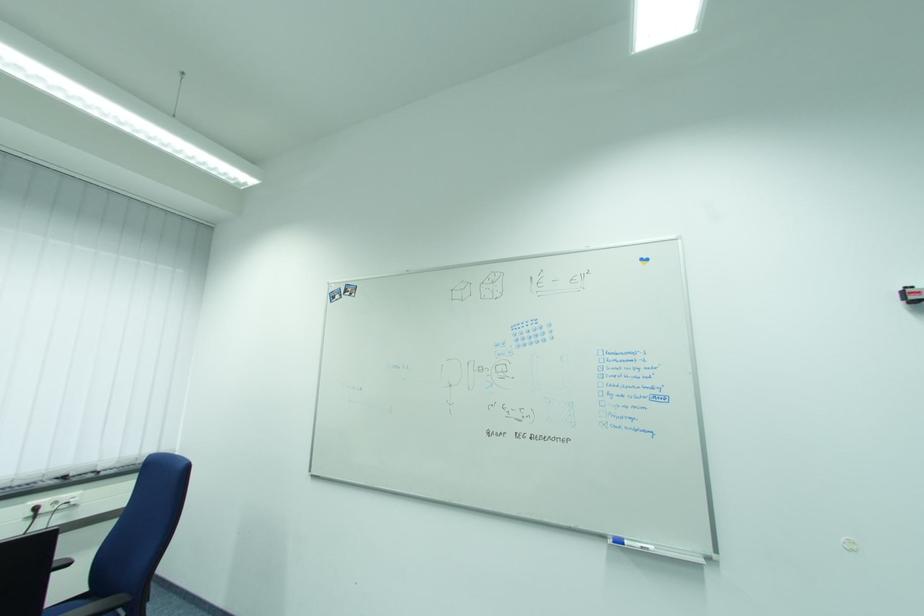
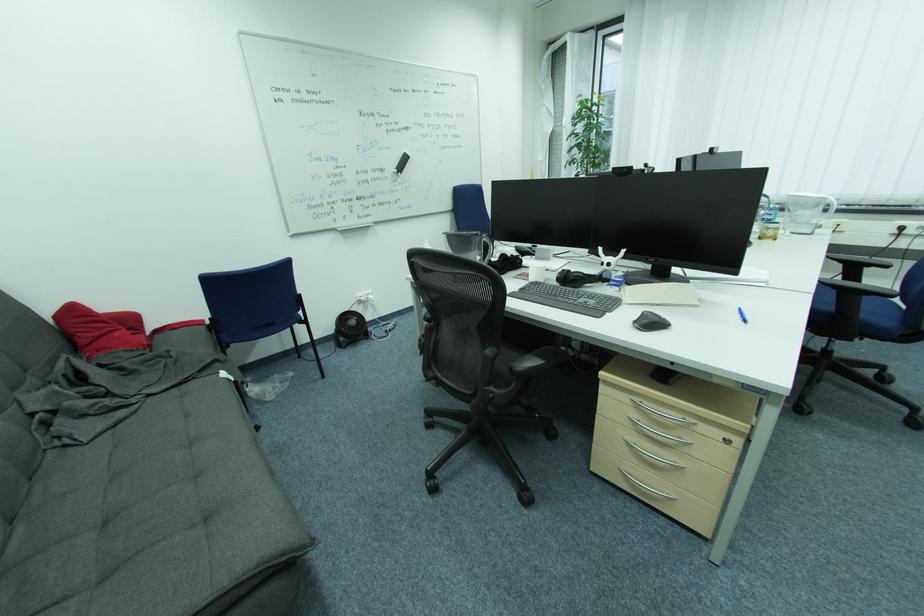
Based on the continuous images, in which direction is the camera rotating?

The rotation direction of the camera is left-down.